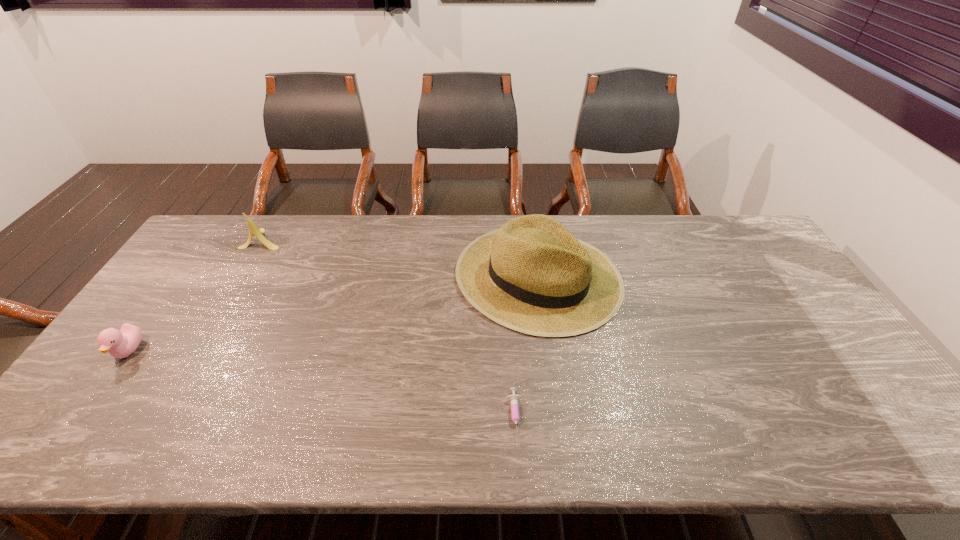
Where is `vacant space situated 0.300m on the right of the nearest object`? This screenshot has height=540, width=960. vacant space situated 0.300m on the right of the nearest object is located at coordinates click(651, 418).

You are a GUI agent. You are given a task and a screenshot of the screen. Output one action in this format:
    pyautogui.click(x=<x>, y=<y>)
    Task: Click on the sunhat at the far edge
    Image resolution: width=960 pixels, height=540 pixels.
    Given the screenshot: What is the action you would take?
    pyautogui.click(x=532, y=275)

Where is `banana present at the far edge`? banana present at the far edge is located at coordinates (253, 229).

Where is `object that is at the near edge`? Image resolution: width=960 pixels, height=540 pixels. object that is at the near edge is located at coordinates (514, 399).

In order to click on banana situated at the left edge in this screenshot , I will do `click(253, 229)`.

Where is `duckling present at the left edge`? Image resolution: width=960 pixels, height=540 pixels. duckling present at the left edge is located at coordinates (121, 343).

Image resolution: width=960 pixels, height=540 pixels. What are the coordinates of `object situated at the far left corner` in the screenshot? It's located at (253, 229).

In the image, there is a desktop. Identify the location of vacant space at the far edge. 694,229.

This screenshot has height=540, width=960. Identify the location of vacant space at the near edge of the desktop. (630, 423).

This screenshot has height=540, width=960. I want to click on vacant space at the right edge of the desktop, so click(x=756, y=282).